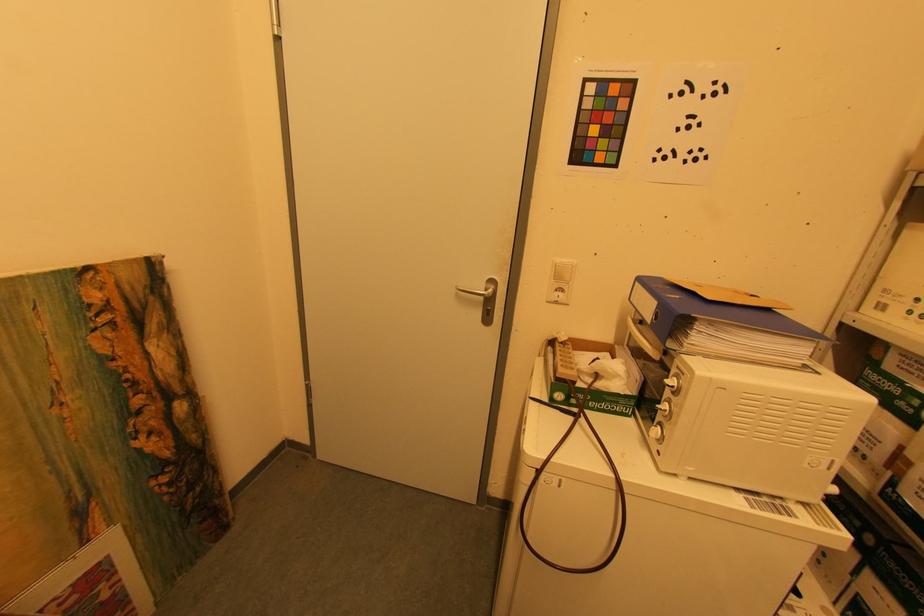
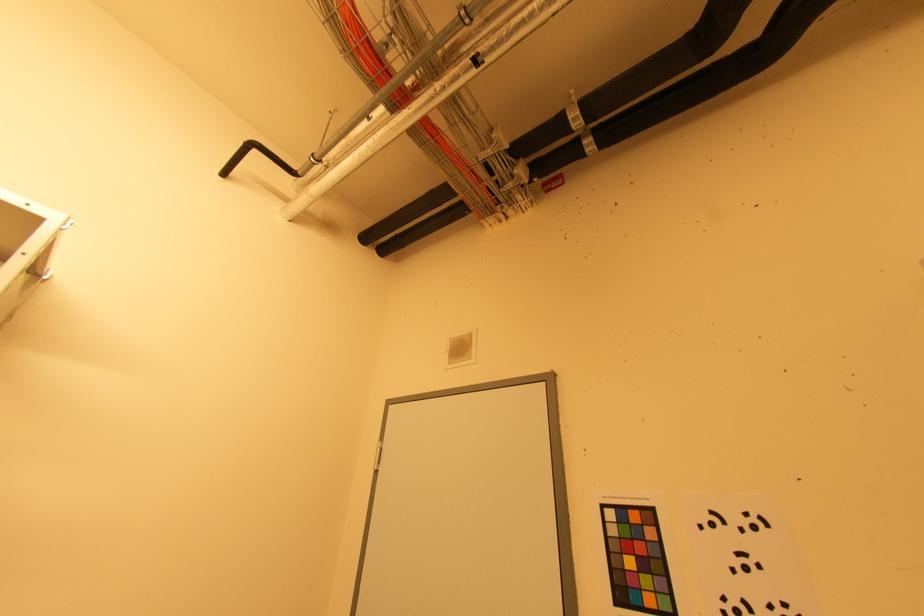
The images are taken continuously from a first-person perspective. In which direction is your viewpoint rotating?

The rotation direction of the camera is left-up.